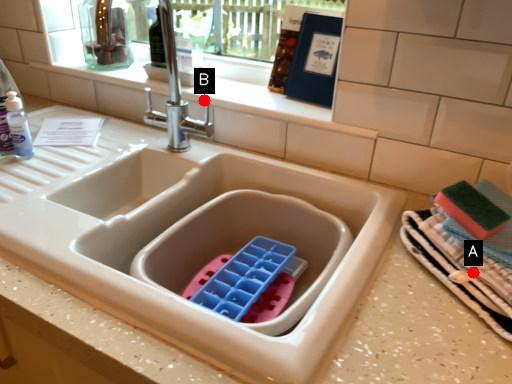
Question: Two points are circled on the image, labeled by A and B beside each circle. Among these points, which one is nearest to the camera?

Choices:
 (A) A is closer
 (B) B is closer

Answer: (A)